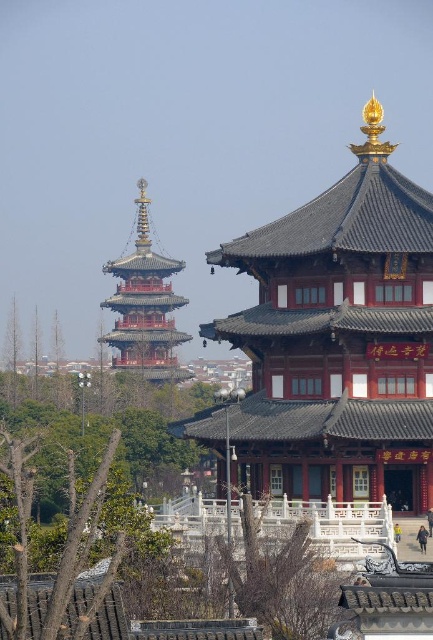
Does shiny gold pagoda at upper left have a larger size compared to reddish-brown wooden pagoda at upper left?

No, shiny gold pagoda at upper left is not bigger than reddish-brown wooden pagoda at upper left.

The width and height of the screenshot is (433, 640). Find the location of `shiny gold pagoda at upper left`. shiny gold pagoda at upper left is located at coordinates (339, 339).